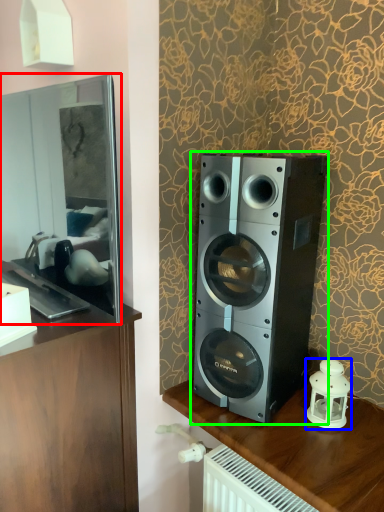
Question: Based on their relative distances, which object is nearer to mirror (highlighted by a red box)? Choose from candle holder (highlighted by a blue box) and home appliance (highlighted by a green box).

Choices:
 (A) candle holder
 (B) home appliance

Answer: (B)